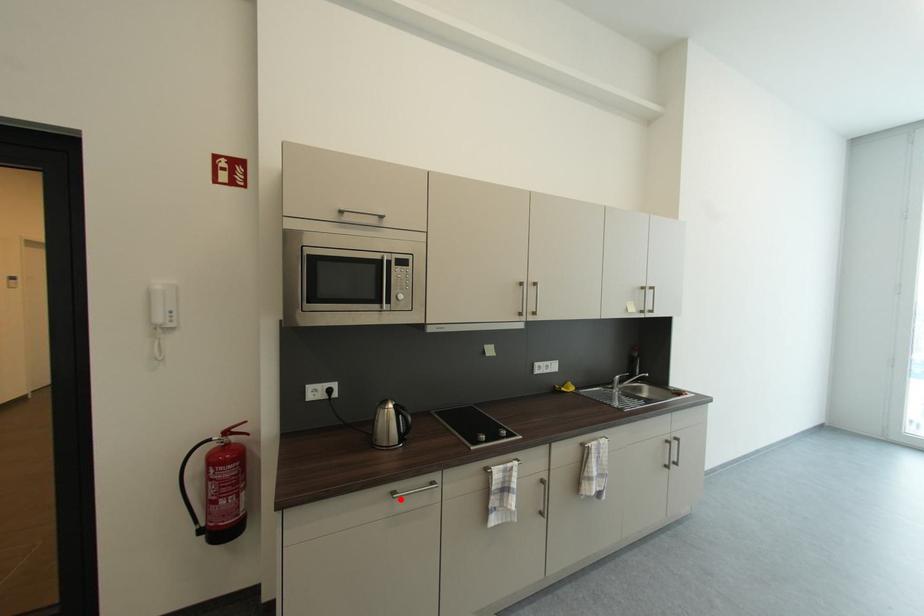
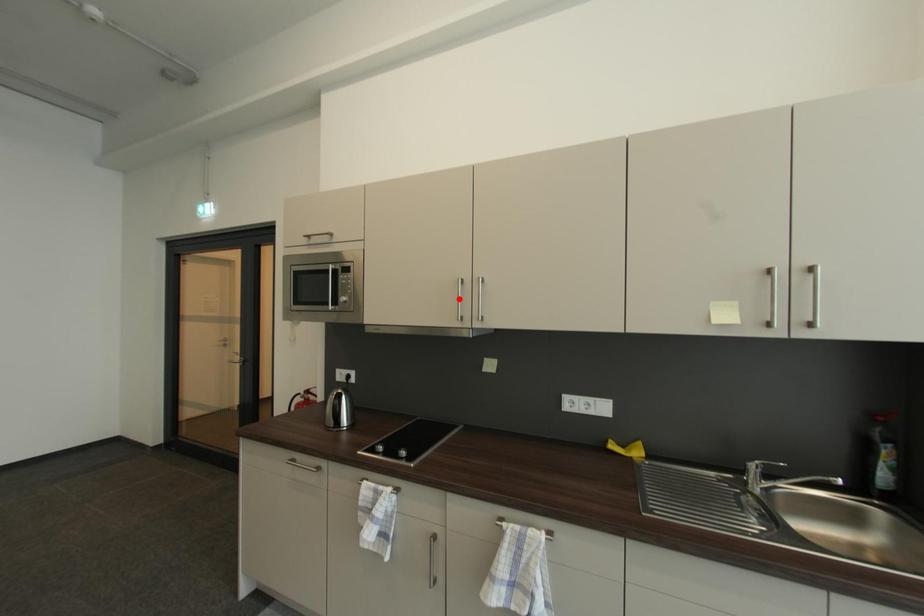
I am providing you with two images of the same scene from different viewpoints. A red point is marked on the first image and another point is marked on the second image. Is the marked point in image1 the same physical position as the marked point in image2?

No